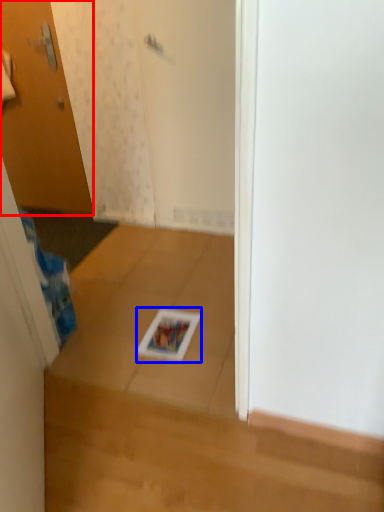
Question: Which of the following is the closest to the observer, door (highlighted by a red box) or magazine (highlighted by a blue box)?

Choices:
 (A) door
 (B) magazine

Answer: (B)